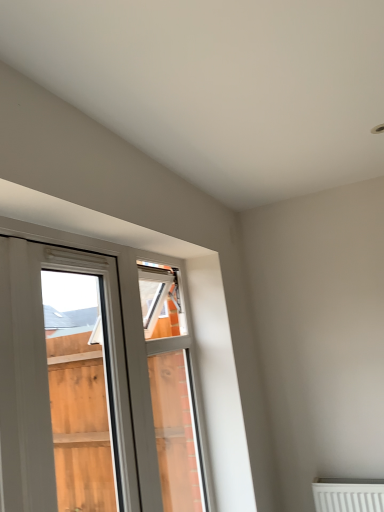
Question: From a real-world perspective, is white plastic window frame at center beneath white plastic window at left?

Choices:
 (A) no
 (B) yes

Answer: (B)

Question: Considering the relative sizes of white plastic window frame at center and white plastic window at left in the image provided, is white plastic window frame at center smaller than white plastic window at left?

Choices:
 (A) no
 (B) yes

Answer: (A)

Question: Is white plastic window frame at center at the right side of white plastic window at left?

Choices:
 (A) no
 (B) yes

Answer: (B)

Question: Can you confirm if white plastic window frame at center is thinner than white plastic window at left?

Choices:
 (A) yes
 (B) no

Answer: (B)

Question: Is white plastic window frame at center oriented away from white plastic window at left?

Choices:
 (A) no
 (B) yes

Answer: (A)

Question: From a real-world perspective, is white plastic window frame at center on top of white plastic window at left?

Choices:
 (A) no
 (B) yes

Answer: (A)

Question: Are white plastic window at left and white plastic window frame at center far apart?

Choices:
 (A) no
 (B) yes

Answer: (A)

Question: Can you confirm if white plastic window at left is bigger than white plastic window frame at center?

Choices:
 (A) yes
 (B) no

Answer: (B)

Question: From the image's perspective, is white plastic window at left located above white plastic window frame at center?

Choices:
 (A) yes
 (B) no

Answer: (A)

Question: Is white plastic window at left next to white plastic window frame at center and touching it?

Choices:
 (A) no
 (B) yes

Answer: (A)

Question: Would you say white plastic window at left contains white plastic window frame at center?

Choices:
 (A) no
 (B) yes

Answer: (A)

Question: Can you confirm if white plastic window at left is smaller than white plastic window frame at center?

Choices:
 (A) yes
 (B) no

Answer: (A)

Question: Is white plastic window frame at center bigger or smaller than white plastic window at left?

Choices:
 (A) small
 (B) big

Answer: (B)